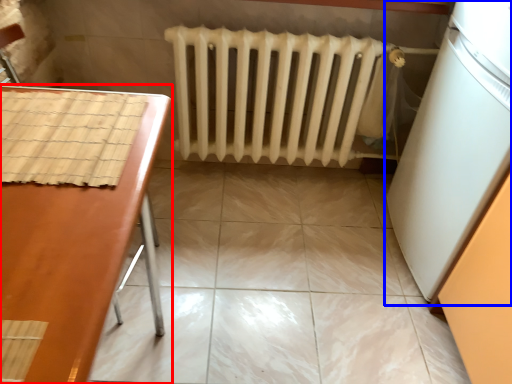
Question: Which object appears farthest to the camera in this image, furniture (highlighted by a red box) or appliance (highlighted by a blue box)?

Choices:
 (A) furniture
 (B) appliance

Answer: (B)